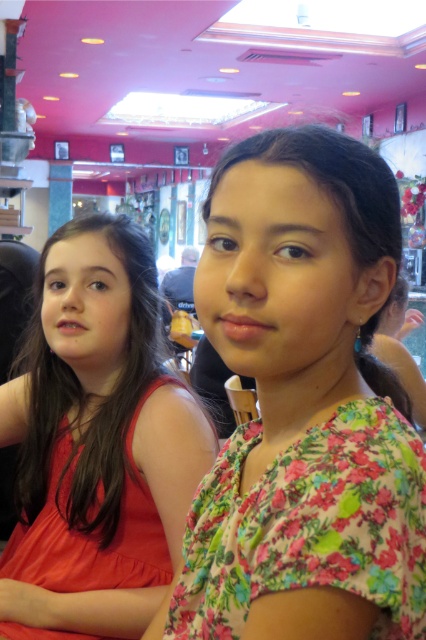
Can you confirm if floral fabric dress at center is bigger than matte orange dress at center?

No, floral fabric dress at center is not bigger than matte orange dress at center.

Does point (273, 198) come in front of point (28, 506)?

Yes, point (273, 198) is closer to viewer.

At what (x,y) coordinates should I click in order to perform the action: click on floral fabric dress at center. Please return your answer as a coordinate pair (x, y). The image size is (426, 640). Looking at the image, I should click on (296, 392).